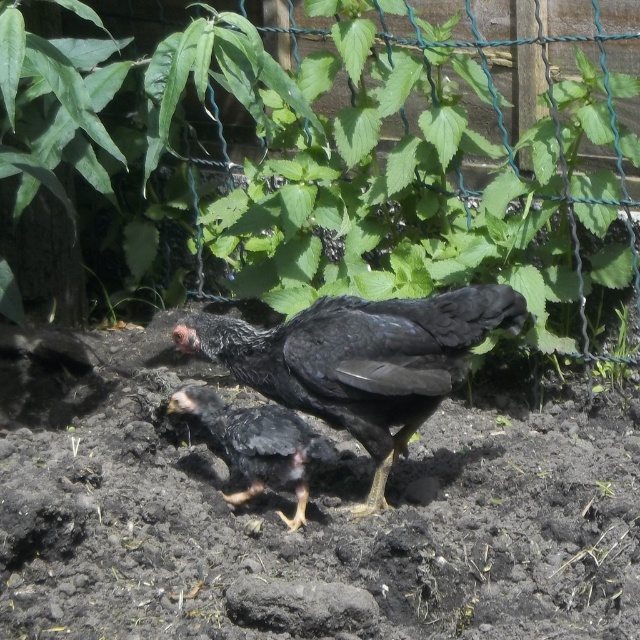
Question: Estimate the real-world distances between objects in this image. Which object is closer to the black matte chicken at center?

Choices:
 (A) green leafy plant at center
 (B) shiny black chicken at center

Answer: (B)

Question: Which point is closer to the camera?

Choices:
 (A) (333, 36)
 (B) (307, 493)

Answer: (B)

Question: From the image, what is the correct spatial relationship of green leafy plant at center in relation to shiny black chicken at center?

Choices:
 (A) below
 (B) above

Answer: (B)

Question: From the image, what is the correct spatial relationship of green leafy plant at center in relation to black matte chicken at center?

Choices:
 (A) below
 (B) above

Answer: (B)

Question: Which point is closer to the camera?

Choices:
 (A) (230, 426)
 (B) (476, 237)

Answer: (A)

Question: Can you confirm if green leafy plant at center is positioned above black matte chicken at center?

Choices:
 (A) yes
 (B) no

Answer: (A)